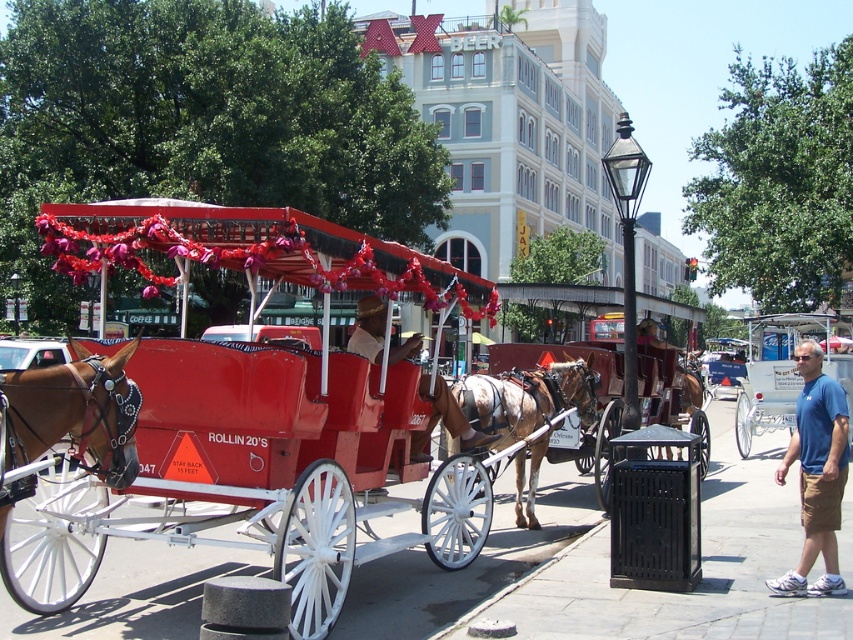
Is point (828, 540) positioned behind point (360, 324)?

No.

Does blue cotton shirt at lower right appear on the left side of smooth brown leather hat at center?

Incorrect, blue cotton shirt at lower right is not on the left side of smooth brown leather hat at center.

Is point (830, 388) in front of point (399, 358)?

Yes, point (830, 388) is in front of point (399, 358).

You are a GUI agent. You are given a task and a screenshot of the screen. Output one action in this format:
    pyautogui.click(x=<x>, y=<y>)
    Task: Click on the blue cotton shirt at lower right
    
    Given the screenshot: What is the action you would take?
    pyautogui.click(x=816, y=472)

Does point (531, 486) come behind point (756, 378)?

No, it is in front of (756, 378).

Which of these two, brown speckled horse at center or white polished wood wagon at center, stands shorter?

brown speckled horse at center

Find the location of a particular element. brown speckled horse at center is located at coordinates (527, 397).

Is point (262, 256) farther from camera compared to point (830, 557)?

That is False.

From the picture: Who is more forward, (x=346, y=573) or (x=827, y=548)?

Point (x=346, y=573) is more forward.

Find the location of a particular element. This screenshot has width=853, height=640. shiny red carriage at center is located at coordinates (258, 416).